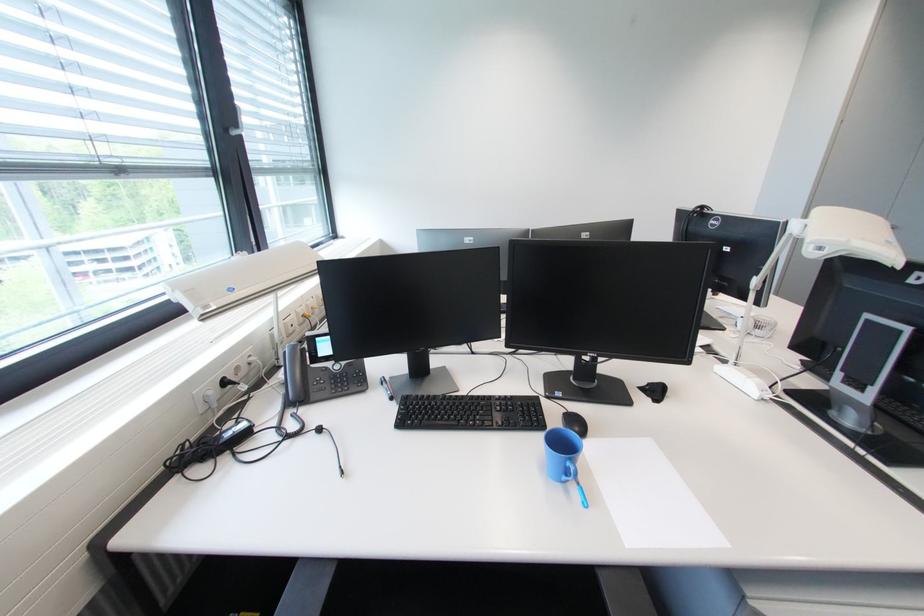
The location [580,493] corresponds to which object?

It refers to a blue pen.